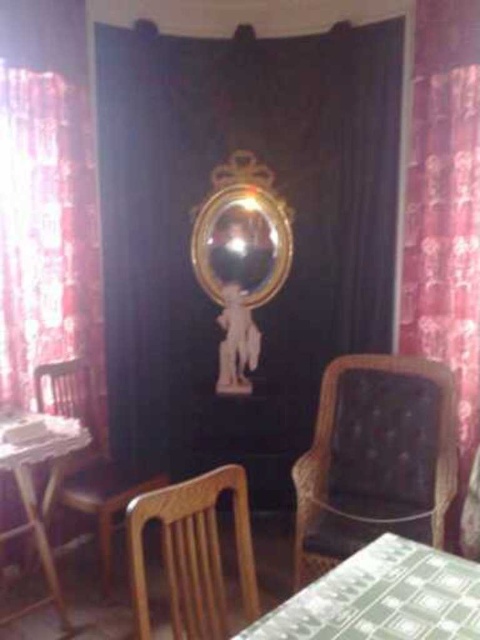
Question: Can you confirm if gold reflective mirror at center is positioned below wooden chair at left?

Choices:
 (A) no
 (B) yes

Answer: (A)

Question: Is velvet burgundy curtain at right smaller than wooden table at left?

Choices:
 (A) yes
 (B) no

Answer: (B)

Question: Is green checkered tablecloth at lower center further to camera compared to wooden table at left?

Choices:
 (A) yes
 (B) no

Answer: (B)

Question: Which point is farther to the camera?

Choices:
 (A) wooden chair at center
 (B) green checkered tablecloth at lower center
 (C) wooden chair at left

Answer: (C)

Question: Considering the real-world distances, which object is closest to the gold reflective mirror at center?

Choices:
 (A) brown textured armchair at center
 (B) wooden chair at left
 (C) wooden table at left
 (D) velvet burgundy curtain at right

Answer: (D)

Question: Which object appears farthest from the camera in this image?

Choices:
 (A) velvet burgundy curtain at right
 (B) gold reflective mirror at center

Answer: (B)